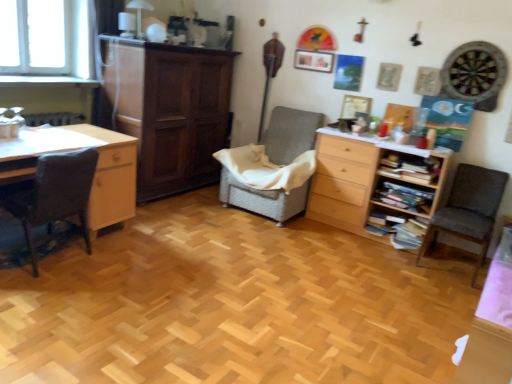
Locate an element on the screen. This screenshot has width=512, height=384. empty space that is in between light wood chest of drawers at center right and dark gray fabric chair at left, the first chair from the left is located at coordinates (239, 245).